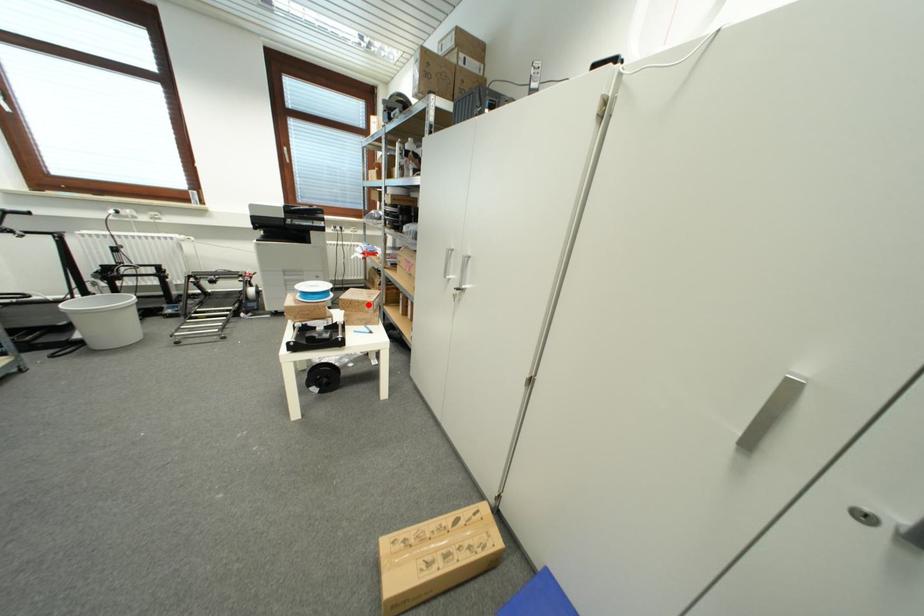
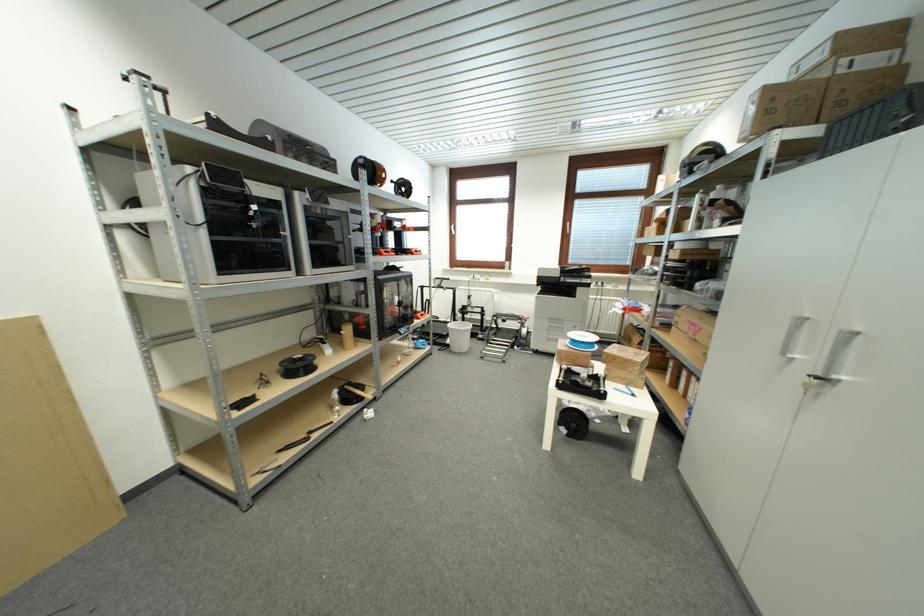
Find the pixel in the second image that matches the highlighted location in the first image.

(634, 363)